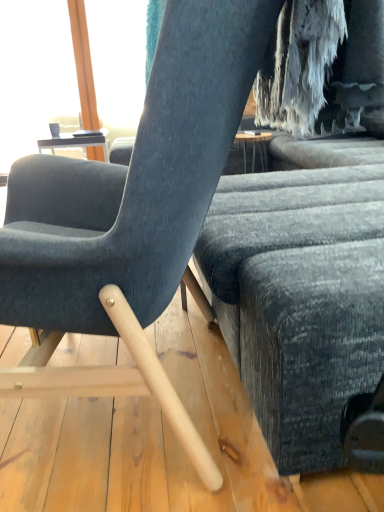
Question: Is matte black screen at upper left bigger or smaller than textured gray fabric couch at center?

Choices:
 (A) big
 (B) small

Answer: (B)

Question: In terms of width, does matte black screen at upper left look wider or thinner when compared to textured gray fabric couch at center?

Choices:
 (A) thin
 (B) wide

Answer: (A)

Question: Considering the real-world distances, which object is farthest from the matte black screen at upper left?

Choices:
 (A) textured gray fabric couch at center
 (B) matte gray chair at center

Answer: (B)

Question: Which of these objects is positioned closest to the matte gray chair at center?

Choices:
 (A) matte black screen at upper left
 (B) textured gray fabric couch at center

Answer: (B)